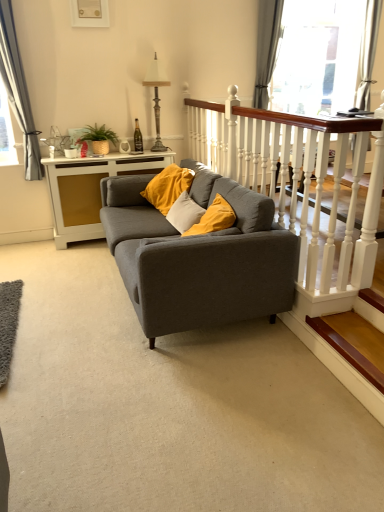
The width and height of the screenshot is (384, 512). Identify the location of transparent glass door at upper center. [317, 56].

What do you see at coordinates (317, 56) in the screenshot? I see `transparent glass door at upper center` at bounding box center [317, 56].

The width and height of the screenshot is (384, 512). In order to click on wooden at lower right in this screenshot , I will do `click(348, 352)`.

This screenshot has height=512, width=384. Describe the element at coordinates (348, 352) in the screenshot. I see `wooden at lower right` at that location.

This screenshot has width=384, height=512. Describe the element at coordinates (90, 190) in the screenshot. I see `white glossy side table at center` at that location.

Locate an element on the screen. green woven basket at upper left is located at coordinates (99, 138).

Measure the distance between point (105, 146) and camera.

A distance of 4.00 meters exists between point (105, 146) and camera.

This screenshot has width=384, height=512. What do you see at coordinates (89, 13) in the screenshot?
I see `matte white picture frame at upper center` at bounding box center [89, 13].

At what (x,y) coordinates should I click in order to perform the action: click on antique bronze lamp at upper center. Please return your answer as a coordinate pair (x, y). Looking at the image, I should click on (156, 97).

Is antique bronze lamp at upper center oriented towards wooden at lower right?

Yes, antique bronze lamp at upper center faces towards wooden at lower right.

From a real-world perspective, which is physically below, antique bronze lamp at upper center or wooden at lower right?

From a 3D spatial view, wooden at lower right is below.

Does antique bronze lamp at upper center appear on the left side of wooden at lower right?

Indeed, antique bronze lamp at upper center is positioned on the left side of wooden at lower right.

From a real-world perspective, is silky white curtain at upper right, the 3th curtain when ordered from left to right, positioned under gray fabric curtain at left, acting as the 1th curtain starting from the left, based on gravity?

No, from a real-world perspective, silky white curtain at upper right, the 3th curtain when ordered from left to right, is not under gray fabric curtain at left, acting as the 1th curtain starting from the left.

Between point (362, 105) and point (25, 156), which one is positioned behind?

The point (362, 105) is farther from the camera.

In the scene shown: Between silky white curtain at upper right, the 3th curtain when ordered from left to right, and gray fabric curtain at left, acting as the 1th curtain starting from the left, which one has less height?

Standing shorter between the two is silky white curtain at upper right, the 3th curtain when ordered from left to right.

Considering the relative sizes of gray fabric curtain at left, acting as the 1th curtain starting from the left, and white glossy side table at center in the image provided, is gray fabric curtain at left, acting as the 1th curtain starting from the left, thinner than white glossy side table at center?

Yes.

Is the depth of gray fabric curtain at left, acting as the 1th curtain starting from the left, greater than that of white glossy side table at center?

That is False.

Can you confirm if gray fabric curtain at left, which is the third curtain in right-to-left order, is positioned to the right of white glossy side table at center?

Incorrect, gray fabric curtain at left, which is the third curtain in right-to-left order, is not on the right side of white glossy side table at center.

Is point (12, 20) positioned after point (231, 269)?

That is True.

Is gray fabric curtain at left, which is the third curtain in right-to-left order, aimed at matte gray couch at center?

No.

What's the angular difference between gray fabric curtain at left, which is the third curtain in right-to-left order, and matte gray couch at center's facing directions?

gray fabric curtain at left, which is the third curtain in right-to-left order, and matte gray couch at center are facing 89.3 degrees away from each other.

Can you tell me how much gray fabric curtain at left, acting as the 1th curtain starting from the left, and transparent glass door at upper center differ in facing direction?

0.000155 degrees separate the facing orientations of gray fabric curtain at left, acting as the 1th curtain starting from the left, and transparent glass door at upper center.

Are gray fabric curtain at left, acting as the 1th curtain starting from the left, and transparent glass door at upper center far apart?

Yes, gray fabric curtain at left, acting as the 1th curtain starting from the left, and transparent glass door at upper center are located far from each other.

From the image's perspective, which one is positioned higher, gray fabric curtain at left, acting as the 1th curtain starting from the left, or transparent glass door at upper center?

From the image's view, transparent glass door at upper center is above.

Is gray fabric curtain at left, which is the third curtain in right-to-left order, shorter than transparent glass door at upper center?

Incorrect, the height of gray fabric curtain at left, which is the third curtain in right-to-left order, does not fall short of that of transparent glass door at upper center.

Locate an element on the screen. The width and height of the screenshot is (384, 512). picture frame above the antique bronze lamp at upper center (from a real-world perspective) is located at coordinates (89, 13).

Would you consider antique bronze lamp at upper center to be distant from matte white picture frame at upper center?

That's not correct — antique bronze lamp at upper center is a little close to matte white picture frame at upper center.

Relative to matte white picture frame at upper center, is antique bronze lamp at upper center in front or behind?

In the image, antique bronze lamp at upper center appears behind matte white picture frame at upper center.

In the scene shown: Looking at their sizes, would you say antique bronze lamp at upper center is wider or thinner than matte white picture frame at upper center?

Considering their sizes, antique bronze lamp at upper center looks broader than matte white picture frame at upper center.

Where is `glass door lying above the matte white picture frame at upper center (from the image's perspective)`? The height and width of the screenshot is (512, 384). glass door lying above the matte white picture frame at upper center (from the image's perspective) is located at coordinates (317, 56).

Does transparent glass door at upper center have a lesser width compared to matte white picture frame at upper center?

In fact, transparent glass door at upper center might be wider than matte white picture frame at upper center.

Looking at this image, considering the sizes of transparent glass door at upper center and matte white picture frame at upper center in the image, is transparent glass door at upper center taller or shorter than matte white picture frame at upper center?

Clearly, transparent glass door at upper center is taller compared to matte white picture frame at upper center.

Is transparent glass door at upper center positioned in front of matte white picture frame at upper center?

No, it is not.

Where is `lamp above the wooden at lower right (from a real-world perspective)`? The image size is (384, 512). lamp above the wooden at lower right (from a real-world perspective) is located at coordinates (156, 97).

Which curtain is the 2nd one when counting from the back of the gray fabric curtain at left, acting as the 1th curtain starting from the left? Please provide its 2D coordinates.

[(368, 55)]

From the image, which object appears to be farther from white wood balustrade at upper right, white glossy side table at center or matte gray couch at center?

Among the two, white glossy side table at center is located further to white wood balustrade at upper right.

When comparing their distances from silky white curtain at upper right, which ranks as the 1th curtain in right-to-left order, does matte white picture frame at upper center or gray fabric curtain at left, acting as the 1th curtain starting from the left, seem closer?

matte white picture frame at upper center lies closer to silky white curtain at upper right, which ranks as the 1th curtain in right-to-left order, than the other object.

Looking at the image, which one is located further to gray fabric curtain at upper right, the second curtain positioned from the right, matte gray couch at center or white glossy side table at center?

matte gray couch at center is further to gray fabric curtain at upper right, the second curtain positioned from the right.

When comparing their distances from matte gray couch at center, does matte white picture frame at upper center or antique bronze lamp at upper center seem closer?

antique bronze lamp at upper center.

Looking at the image, which one is located further to white wood balustrade at upper right, matte white picture frame at upper center or gray fabric curtain at left, acting as the 1th curtain starting from the left?

Among the two, gray fabric curtain at left, acting as the 1th curtain starting from the left, is located further to white wood balustrade at upper right.

Looking at the image, which one is located closer to matte white picture frame at upper center, silky white curtain at upper right, the 3th curtain when ordered from left to right, or wooden at lower right?

Among the two, silky white curtain at upper right, the 3th curtain when ordered from left to right, is located nearer to matte white picture frame at upper center.

Considering their positions, is white glossy side table at center positioned further to gray fabric curtain at left, acting as the 1th curtain starting from the left, than transparent glass door at upper center?

Among the two, transparent glass door at upper center is located further to gray fabric curtain at left, acting as the 1th curtain starting from the left.

When comparing their distances from white wood balustrade at upper right, does green woven basket at upper left or transparent glass door at upper center seem further?

transparent glass door at upper center is positioned further to the anchor white wood balustrade at upper right.

You are a GUI agent. You are given a task and a screenshot of the screen. Output one action in this format:
    pyautogui.click(x=<x>, y=<y>)
    Task: Click on the stairwell situated between green woven basket at upper left and silky white curtain at upper right, which ranks as the 1th curtain in right-to-left order, from left to right
    Image resolution: width=384 pixels, height=512 pixels.
    Given the screenshot: What is the action you would take?
    pyautogui.click(x=348, y=352)

Where is `table between matte gray couch at center and gray fabric curtain at upper right, the 2th curtain positioned from the left, in the front-back direction`? Image resolution: width=384 pixels, height=512 pixels. table between matte gray couch at center and gray fabric curtain at upper right, the 2th curtain positioned from the left, in the front-back direction is located at coordinates (90, 190).

Where is `lamp between matte white picture frame at upper center and wooden at lower right from top to bottom`? Image resolution: width=384 pixels, height=512 pixels. lamp between matte white picture frame at upper center and wooden at lower right from top to bottom is located at coordinates (156, 97).

Locate an element on the screen. glass door between gray fabric curtain at upper right, the second curtain positioned from the right, and silky white curtain at upper right, the 3th curtain when ordered from left to right is located at coordinates (317, 56).